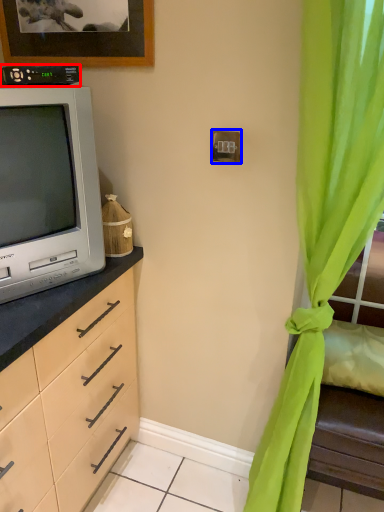
Question: Which object appears closest to the camera in this image, appliance (highlighted by a red box) or electric outlet (highlighted by a blue box)?

Choices:
 (A) appliance
 (B) electric outlet

Answer: (A)